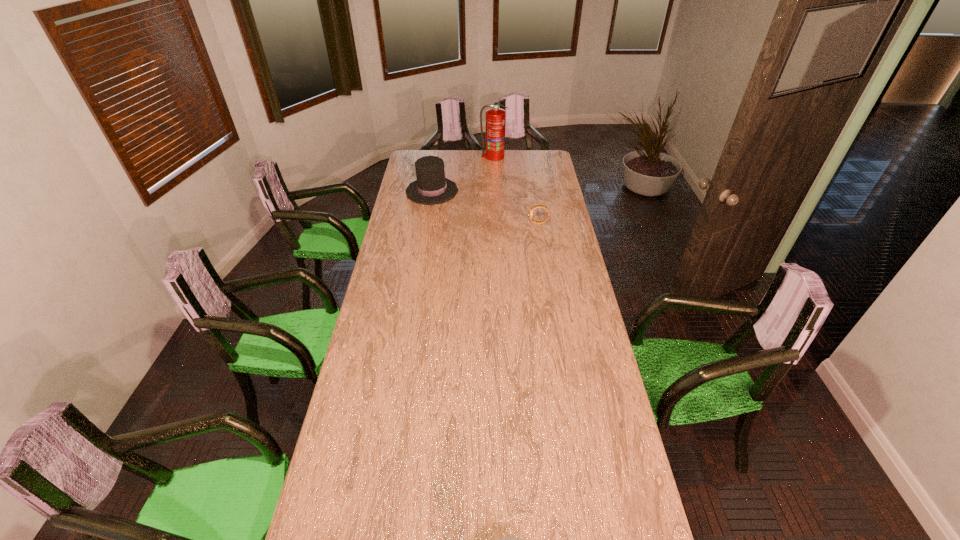
You are a GUI agent. You are given a task and a screenshot of the screen. Output one action in this format:
    pyautogui.click(x=<x>, y=<y>)
    Task: Click on the tallest object
    This screenshot has height=540, width=960.
    Given the screenshot: What is the action you would take?
    pyautogui.click(x=494, y=148)

This screenshot has height=540, width=960. What are the coordinates of `the farthest object` in the screenshot? It's located at (494, 148).

The width and height of the screenshot is (960, 540). I want to click on dress hat, so click(x=431, y=187).

Find the location of a particular element. the third shortest object is located at coordinates (431, 187).

The height and width of the screenshot is (540, 960). Identify the location of the second nearest object. (536, 206).

Locate an element on the screen. the second shortest object is located at coordinates (536, 206).

This screenshot has width=960, height=540. I want to click on free region located on the instruction side of the fire extinguisher, so click(494, 184).

The height and width of the screenshot is (540, 960). I want to click on vacant position located on the front of the second farthest object with the decoration, so click(495, 191).

Where is `free space located on the face of the third farthest object`? This screenshot has width=960, height=540. free space located on the face of the third farthest object is located at coordinates (478, 223).

Find the location of a particular element. vacant region located 0.260m on the face of the third farthest object is located at coordinates (478, 223).